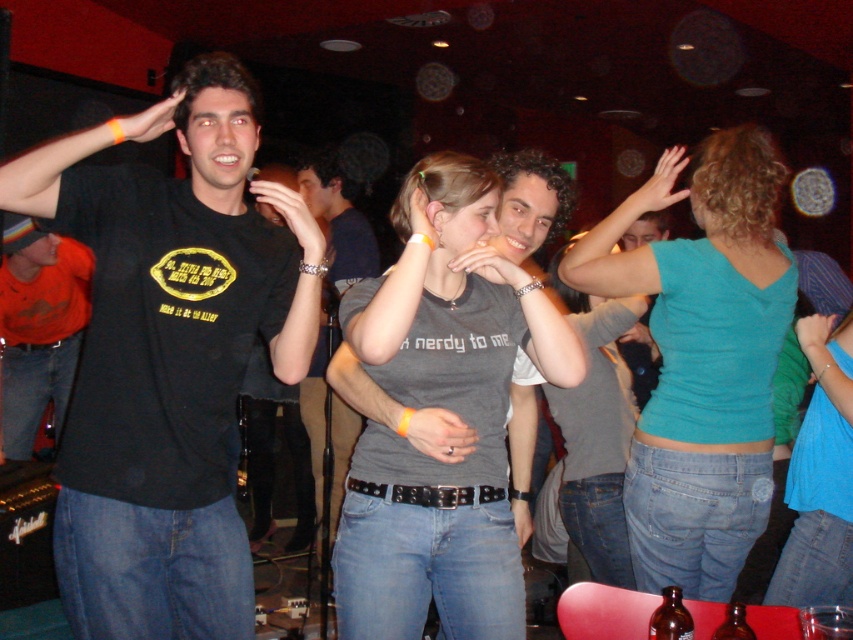
Question: Considering the real-world distances, which object is farthest from the matte gray t-shirt at center?

Choices:
 (A) teal matte tank top at center
 (B) matte black t-shirt at left
 (C) black matte t-shirt at left
 (D) dark gray t-shirt at center

Answer: (C)

Question: Does black matte t-shirt at left appear over matte gray shirt at center?

Choices:
 (A) no
 (B) yes

Answer: (B)

Question: Observing the image, what is the correct spatial positioning of dark gray t-shirt at center in reference to teal matte tank top at center?

Choices:
 (A) above
 (B) below

Answer: (B)

Question: Is matte black t-shirt at left bigger than matte gray t-shirt at center?

Choices:
 (A) yes
 (B) no

Answer: (B)

Question: Which point is closer to the camera?

Choices:
 (A) (463, 173)
 (B) (751, 397)

Answer: (A)

Question: Among these objects, which one is farthest from the camera?

Choices:
 (A) matte gray t-shirt at center
 (B) dark gray t-shirt at center
 (C) teal matte tank top at center
 (D) matte gray shirt at center

Answer: (A)